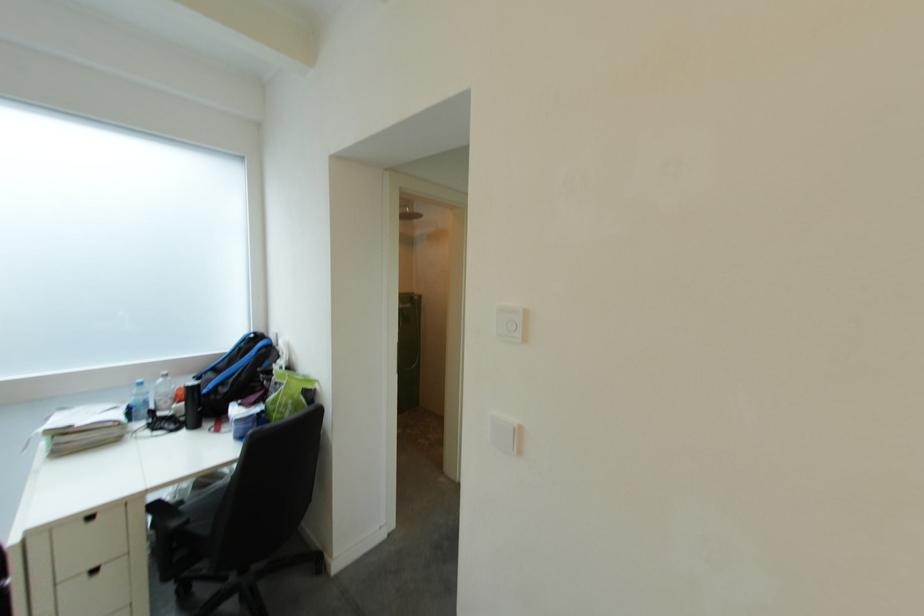
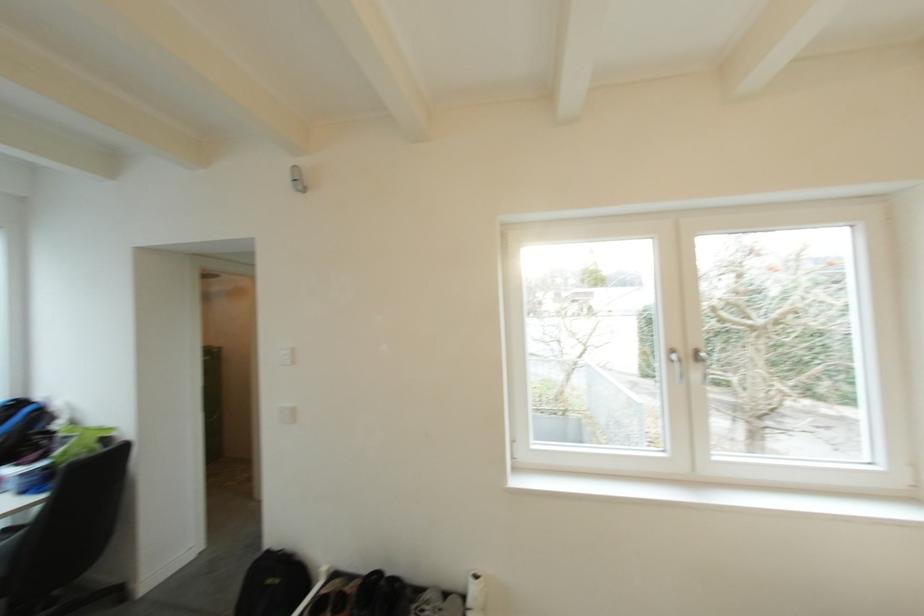
Question: I am providing you with two images of the same scene from different viewpoints. Which of the following objects are not visible in image2?

Choices:
 (A) white light switch
 (B) blue and black backpack
 (C) paper towel roll
 (D) none of these

Answer: (D)